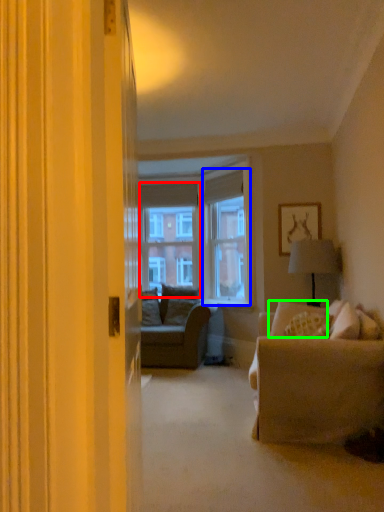
Question: Estimate the real-world distances between objects in this image. Which object is closer to window screen (highlighted by a red box), window screen (highlighted by a blue box) or pillow (highlighted by a green box)?

Choices:
 (A) window screen
 (B) pillow

Answer: (A)